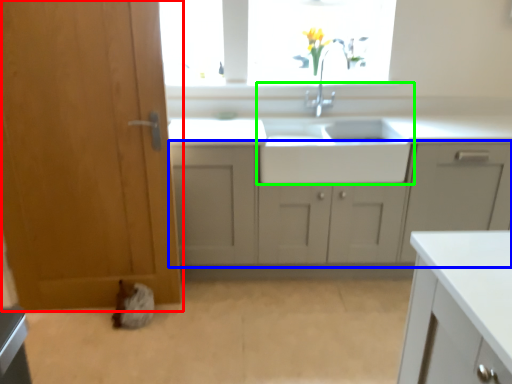
Question: Based on their relative distances, which object is farther from door (highlighted by a red box)? Choose from cabinetry (highlighted by a blue box) and sink (highlighted by a green box).

Choices:
 (A) cabinetry
 (B) sink

Answer: (B)